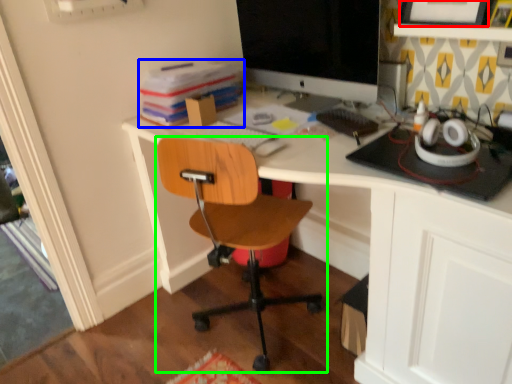
Question: Which object is positioned closest to picture frame (highlighted by a red box)? Select from book (highlighted by a blue box) and chair (highlighted by a green box).

Choices:
 (A) book
 (B) chair

Answer: (A)